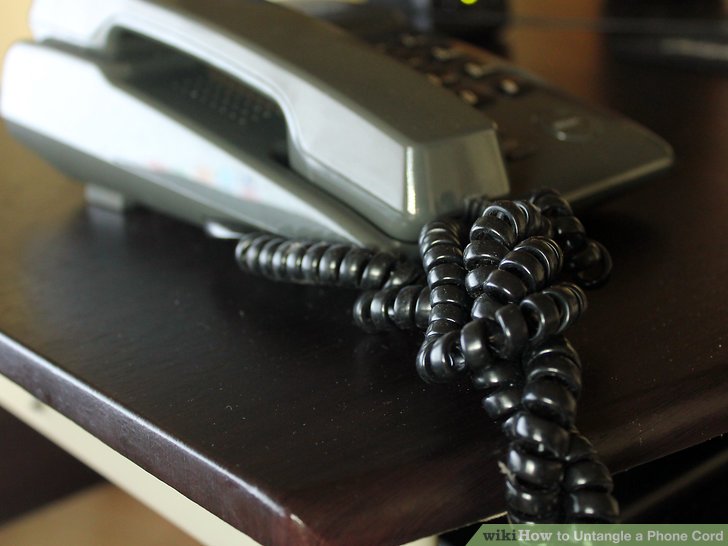
Identify the location of phone base. The image size is (728, 546). (151, 144).